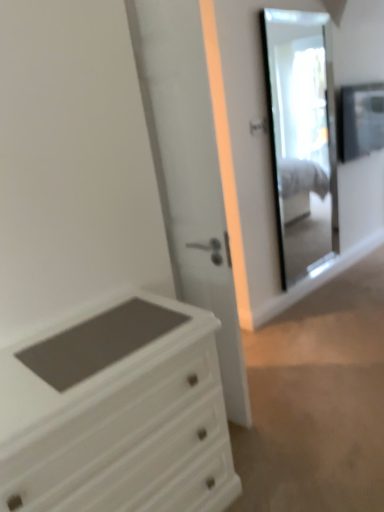
What do you see at coordinates (361, 120) in the screenshot?
I see `matte black frame at upper right` at bounding box center [361, 120].

What is the approximate width of white wood chest of drawers at lower left?

white wood chest of drawers at lower left is 47.21 centimeters in width.

Locate an element on the screen. The width and height of the screenshot is (384, 512). white wood chest of drawers at lower left is located at coordinates (117, 413).

Find the location of a particular element. matte black frame at upper right is located at coordinates (361, 120).

Does matte black frame at upper right touch white wood chest of drawers at lower left?

matte black frame at upper right is not next to white wood chest of drawers at lower left, and they're not touching.

From the image's perspective, is matte black frame at upper right located above white wood chest of drawers at lower left?

Yes.

Is matte black frame at upper right oriented away from white wood chest of drawers at lower left?

That's not correct — matte black frame at upper right is not looking away from white wood chest of drawers at lower left.

Is white wood chest of drawers at lower left not close to matte black frame at upper right?

Yes.

Can matte black frame at upper right be found inside white wood chest of drawers at lower left?

No.

From a real-world perspective, is white wood chest of drawers at lower left below matte black frame at upper right?

Correct, in the physical world, white wood chest of drawers at lower left is lower than matte black frame at upper right.

From the image's perspective, relative to matte black frame at upper right, is white wood chest of drawers at lower left above or below?

From the image's perspective, white wood chest of drawers at lower left appears below matte black frame at upper right.

Between clear glass mirror at upper right and white glossy door at center, which one has smaller size?

With smaller size is clear glass mirror at upper right.

In the scene shown: Is clear glass mirror at upper right facing away from white glossy door at center?

No, clear glass mirror at upper right is not facing away from white glossy door at center.

Which is more to the right, clear glass mirror at upper right or white glossy door at center?

clear glass mirror at upper right.

Is clear glass mirror at upper right shorter than white glossy door at center?

Yes, clear glass mirror at upper right is shorter than white glossy door at center.

Can you confirm if matte black frame at upper right is wider than clear glass mirror at upper right?

Yes, matte black frame at upper right is wider than clear glass mirror at upper right.

Is matte black frame at upper right not inside clear glass mirror at upper right?

Indeed, matte black frame at upper right is completely outside clear glass mirror at upper right.

From the image's perspective, relative to clear glass mirror at upper right, is matte black frame at upper right above or below?

matte black frame at upper right is above clear glass mirror at upper right.

Who is bigger, matte black frame at upper right or clear glass mirror at upper right?

clear glass mirror at upper right.

Is matte black frame at upper right at the right side of white glossy door at center?

Correct, you'll find matte black frame at upper right to the right of white glossy door at center.

Is matte black frame at upper right completely or partially outside of white glossy door at center?

Yes, matte black frame at upper right is located beyond the bounds of white glossy door at center.

Which of these two, matte black frame at upper right or white glossy door at center, is bigger?

white glossy door at center is bigger.

How far apart are matte black frame at upper right and white glossy door at center?

matte black frame at upper right and white glossy door at center are 2.12 meters apart from each other.

How distant is white glossy door at center from clear glass mirror at upper right?

white glossy door at center and clear glass mirror at upper right are 6.82 feet apart.

Would you say white glossy door at center is outside clear glass mirror at upper right?

white glossy door at center is positioned outside clear glass mirror at upper right.

Are white glossy door at center and clear glass mirror at upper right far apart?

Yes, white glossy door at center and clear glass mirror at upper right are located far from each other.

Is white glossy door at center facing away from clear glass mirror at upper right?

No.

Which of these two, white glossy door at center or white wood chest of drawers at lower left, stands shorter?

With less height is white wood chest of drawers at lower left.

From a real-world perspective, between white glossy door at center and white wood chest of drawers at lower left, who is vertically lower?

From a 3D spatial view, white wood chest of drawers at lower left is below.

In the image, is white glossy door at center positioned in front of or behind white wood chest of drawers at lower left?

white glossy door at center is behind white wood chest of drawers at lower left.

Identify the location of the chest of drawers in front of the matte black frame at upper right. Image resolution: width=384 pixels, height=512 pixels. (117, 413).

The width and height of the screenshot is (384, 512). In order to click on window to the right of white wood chest of drawers at lower left in this screenshot , I will do `click(361, 120)`.

Considering their positions, is white glossy door at center positioned closer to matte black frame at upper right than white wood chest of drawers at lower left?

white glossy door at center lies closer to matte black frame at upper right than the other object.

In the scene shown: Estimate the real-world distances between objects in this image. Which object is further from clear glass mirror at upper right, white wood chest of drawers at lower left or matte black frame at upper right?

The object further to clear glass mirror at upper right is white wood chest of drawers at lower left.

Looking at the image, which one is located further to clear glass mirror at upper right, white glossy door at center or white wood chest of drawers at lower left?

white wood chest of drawers at lower left is further to clear glass mirror at upper right.

Based on the photo, considering their positions, is clear glass mirror at upper right positioned further to white glossy door at center than white wood chest of drawers at lower left?

The object further to white glossy door at center is clear glass mirror at upper right.

Based on their spatial positions, is matte black frame at upper right or white glossy door at center further from clear glass mirror at upper right?

white glossy door at center is further to clear glass mirror at upper right.

Considering their positions, is clear glass mirror at upper right positioned closer to white wood chest of drawers at lower left than matte black frame at upper right?

clear glass mirror at upper right is closer to white wood chest of drawers at lower left.

From the image, which object appears to be nearer to matte black frame at upper right, clear glass mirror at upper right or white wood chest of drawers at lower left?

clear glass mirror at upper right.

From the image, which object appears to be farther from white wood chest of drawers at lower left, matte black frame at upper right or white glossy door at center?

The object further to white wood chest of drawers at lower left is matte black frame at upper right.

Where is `mirror positioned between white wood chest of drawers at lower left and matte black frame at upper right from near to far`? Image resolution: width=384 pixels, height=512 pixels. mirror positioned between white wood chest of drawers at lower left and matte black frame at upper right from near to far is located at coordinates (301, 137).

Identify the location of door located between white wood chest of drawers at lower left and matte black frame at upper right in the depth direction. The width and height of the screenshot is (384, 512). (189, 173).

This screenshot has height=512, width=384. Find the location of `mirror positioned between white glossy door at center and matte black frame at upper right from near to far`. mirror positioned between white glossy door at center and matte black frame at upper right from near to far is located at coordinates (301, 137).

Identify the location of door located between white wood chest of drawers at lower left and clear glass mirror at upper right in the depth direction. (189, 173).